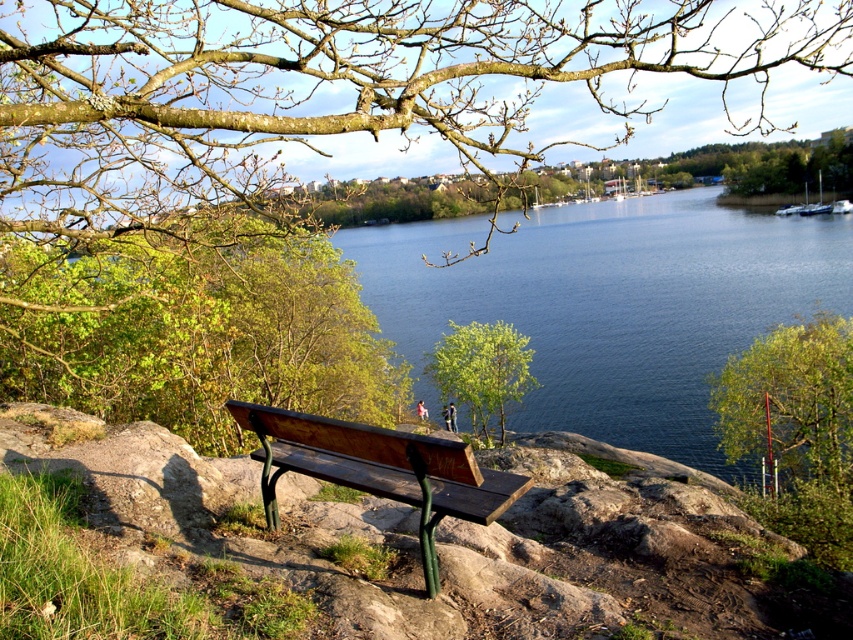
Question: Is wooden bench at center below green leafy tree at center?

Choices:
 (A) no
 (B) yes

Answer: (B)

Question: Can you confirm if green leafy tree at left is positioned above green leafy tree at lower right?

Choices:
 (A) yes
 (B) no

Answer: (A)

Question: Can you confirm if wooden bench at center is thinner than green leafy tree at center?

Choices:
 (A) yes
 (B) no

Answer: (A)

Question: Which point appears closest to the camera in this image?

Choices:
 (A) (33, 285)
 (B) (254, 429)

Answer: (B)

Question: Which point appears closest to the camera in this image?

Choices:
 (A) 326,451
 (B) 264,96
 (C) 320,404

Answer: (A)

Question: Which object is positioned farthest from the green leafy tree at center?

Choices:
 (A) green leafy tree at lower right
 (B) bare branches at upper center
 (C) green leafy tree at left

Answer: (B)